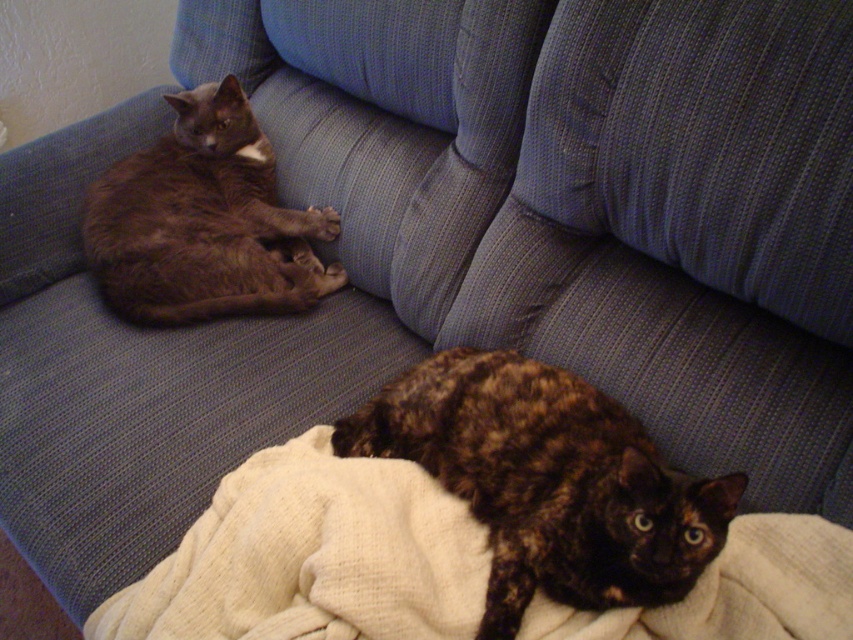
Question: Which point is closer to the camera?

Choices:
 (A) shiny brown cat at left
 (B) blue textured cushion at upper right
 (C) tortoiseshell fur cat at lower center
 (D) creamy woolen blanket at lower center

Answer: (C)

Question: Among these objects, which one is farthest from the camera?

Choices:
 (A) tortoiseshell fur cat at lower center
 (B) creamy woolen blanket at lower center

Answer: (B)

Question: Considering the relative positions of creamy woolen blanket at lower center and tortoiseshell fur cat at lower center in the image provided, where is creamy woolen blanket at lower center located with respect to tortoiseshell fur cat at lower center?

Choices:
 (A) above
 (B) below

Answer: (B)

Question: Which point is closer to the camera?

Choices:
 (A) (381, 516)
 (B) (708, 204)

Answer: (A)

Question: From the image, what is the correct spatial relationship of blue textured cushion at upper right in relation to creamy woolen blanket at lower center?

Choices:
 (A) right
 (B) left

Answer: (A)

Question: Does blue textured cushion at upper right appear on the right side of creamy woolen blanket at lower center?

Choices:
 (A) no
 (B) yes

Answer: (B)